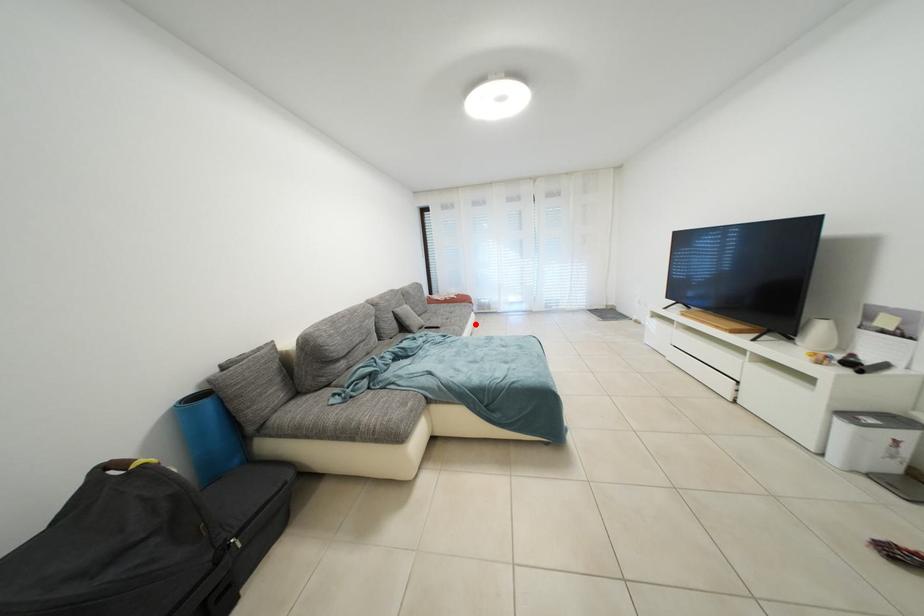
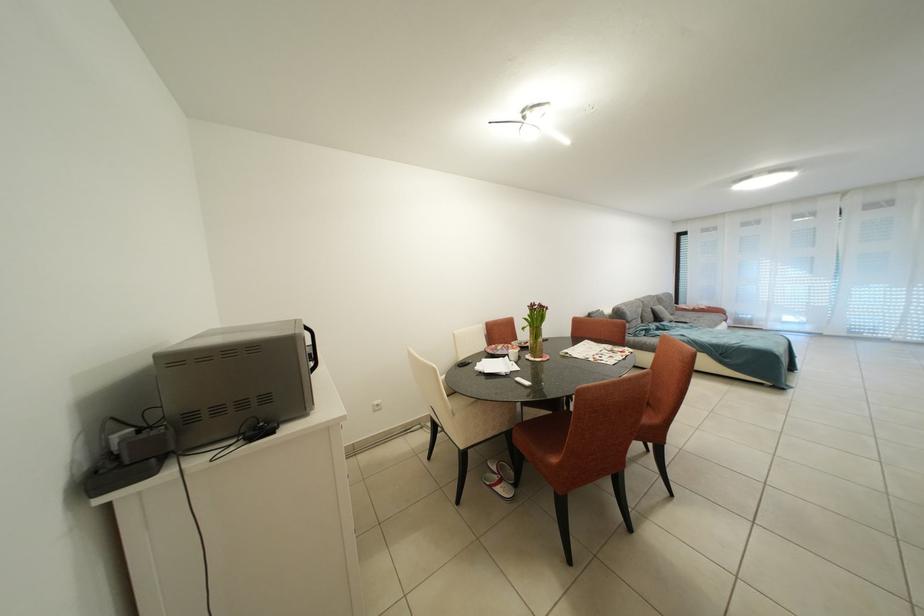
The point at the highlighted location is marked in the first image. Where is the corresponding point in the second image?

(724, 330)